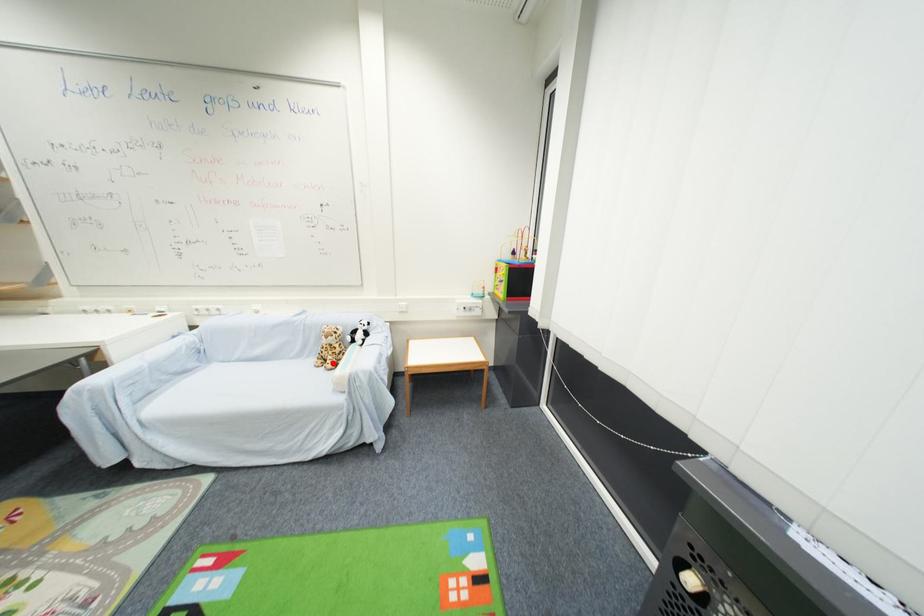
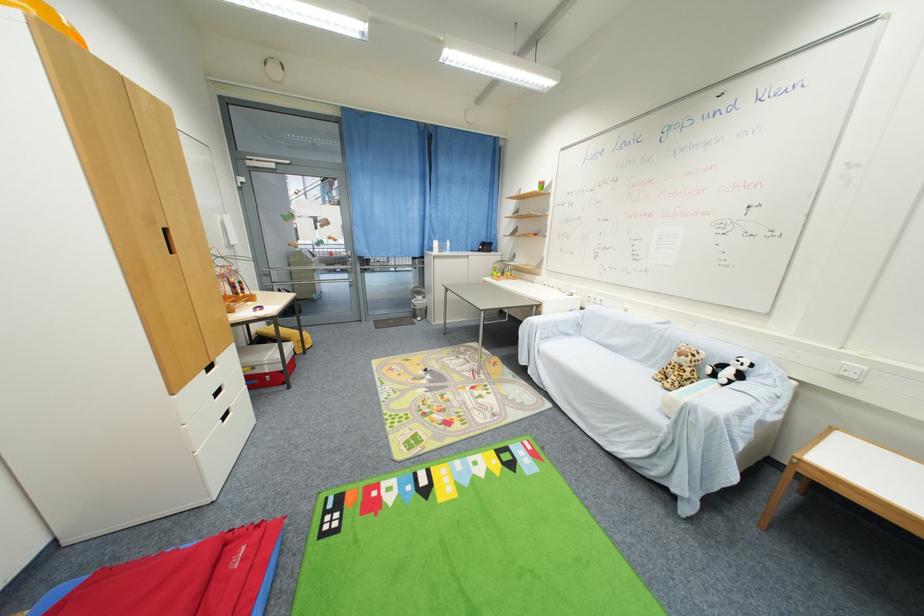
Question: I am providing you with two images of the same scene from different viewpoints. In image1, a red point is highlighted. Considering the same 3D point in image2, which of the following is correct?

Choices:
 (A) It is closer
 (B) It is farther

Answer: (A)